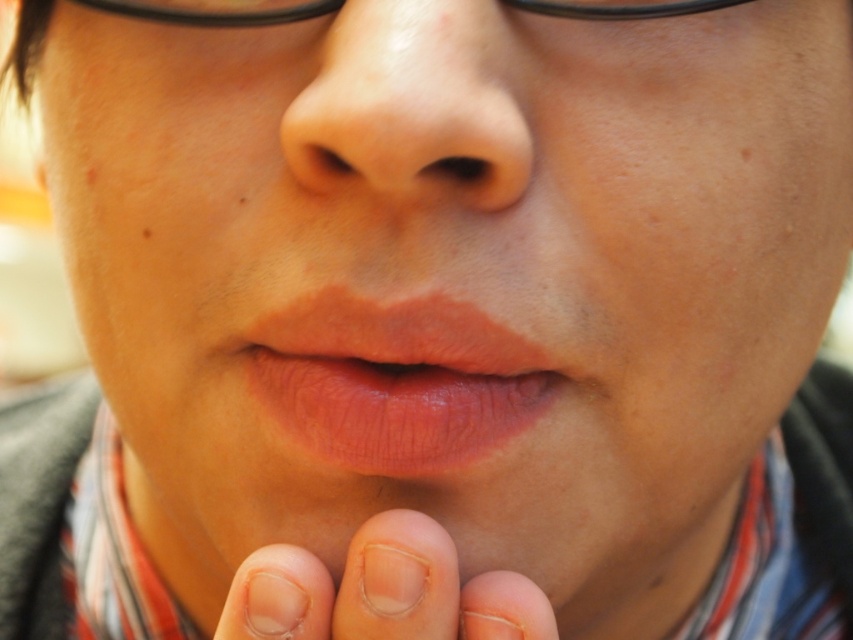
You are taking a photo with a shallow depth of field and want to ensure both points, point (x=531, y=385) and point (x=287, y=129), are in focus. Given the current camera settings, which point is closer to the camera and might be out of focus if the focus is set on the other?

Point (x=287, y=129) is closer to the camera than point (x=531, y=385). If the focus is set on point (x=531, y=385), then point (x=287, y=129) might be out of focus because it is closer and outside the depth of field range.

Based on the scene description, which object is positioned lower in the image? The clear skin at lower center or the black plastic glasses at upper center?

The clear skin at lower center is positioned lower in the image compared to the black plastic glasses at upper center, as it has a lesser height.